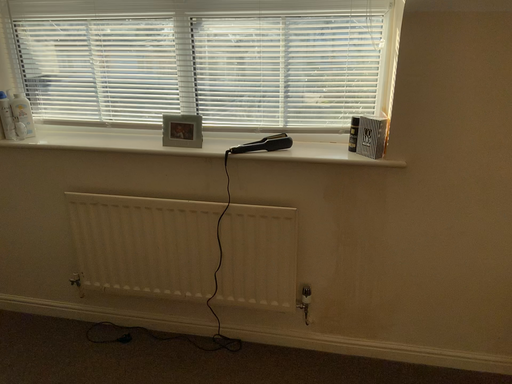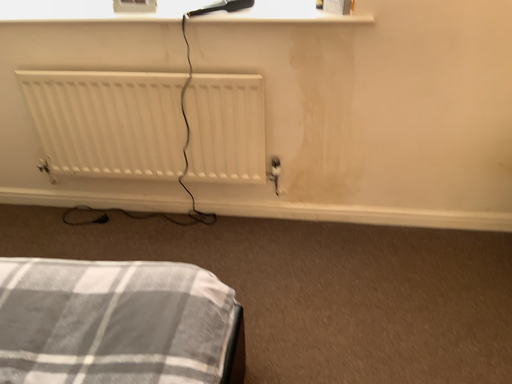
Question: How did the camera likely rotate when shooting the video?

Choices:
 (A) rotated upward
 (B) rotated downward

Answer: (B)